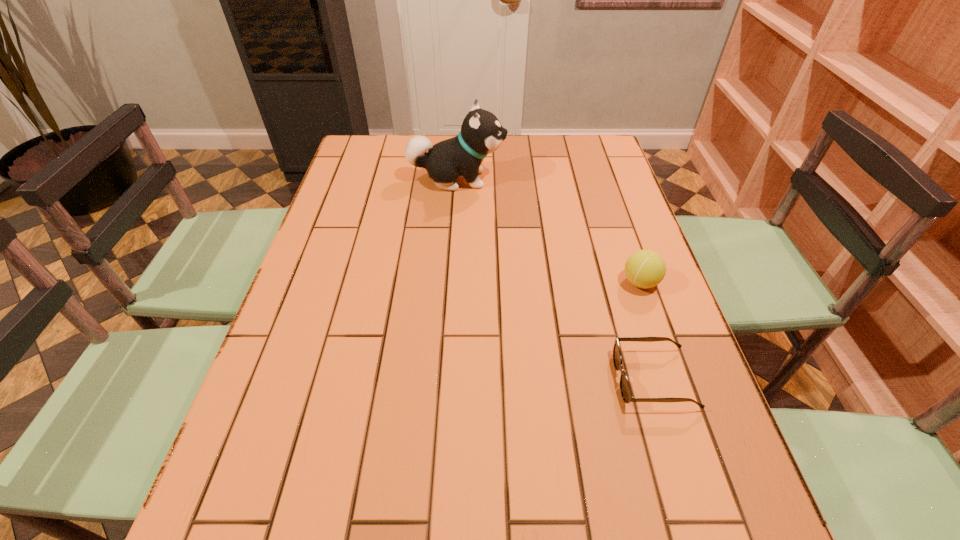
Locate an element on the screen. The image size is (960, 540). free space that is in between the second farthest object and the shortest object is located at coordinates pos(647,330).

The height and width of the screenshot is (540, 960). In order to click on vacant area that lies between the second nearest object and the sunglasses in this screenshot , I will do `click(647, 330)`.

Where is `blank region between the second tallest object and the nearest object`? This screenshot has width=960, height=540. blank region between the second tallest object and the nearest object is located at coordinates [x=647, y=330].

The image size is (960, 540). Find the location of `vacant point located between the second shortest object and the nearest object`. vacant point located between the second shortest object and the nearest object is located at coordinates (647, 330).

Identify the location of free space that is in between the sunglasses and the tallest object. (555, 279).

Where is `vacant space that's between the second nearest object and the shortest object`? Image resolution: width=960 pixels, height=540 pixels. vacant space that's between the second nearest object and the shortest object is located at coordinates (647, 330).

Identify the location of vacant area between the nearest object and the puppy. This screenshot has width=960, height=540. (555, 279).

Find the location of a particular element. This screenshot has height=540, width=960. unoccupied position between the tennis ball and the farthest object is located at coordinates (548, 231).

Identify which object is located as the nearest to the tennis ball. Please provide its 2D coordinates. Your answer should be formatted as a tuple, i.e. [(x, y)], where the tuple contains the x and y coordinates of a point satisfying the conditions above.

[(625, 388)]

Where is `object that can be found as the second closest to the second shortest object`? The height and width of the screenshot is (540, 960). object that can be found as the second closest to the second shortest object is located at coordinates (481, 133).